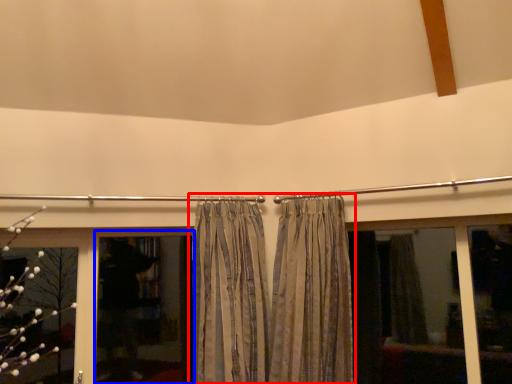
Question: Which of the following is the farthest to the observer, curtain (highlighted by a red box) or screen door (highlighted by a blue box)?

Choices:
 (A) curtain
 (B) screen door

Answer: (B)